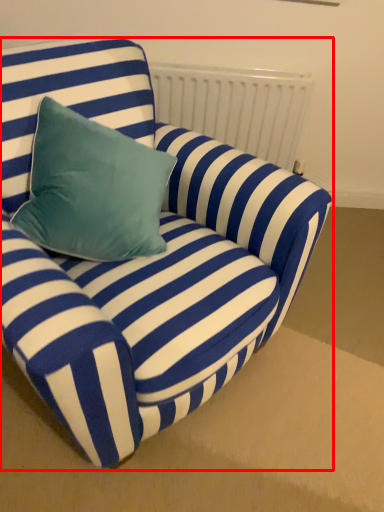
Question: Observing the image, what is the correct spatial positioning of studio couch (annotated by the red box) in reference to radiator?

Choices:
 (A) left
 (B) right

Answer: (A)